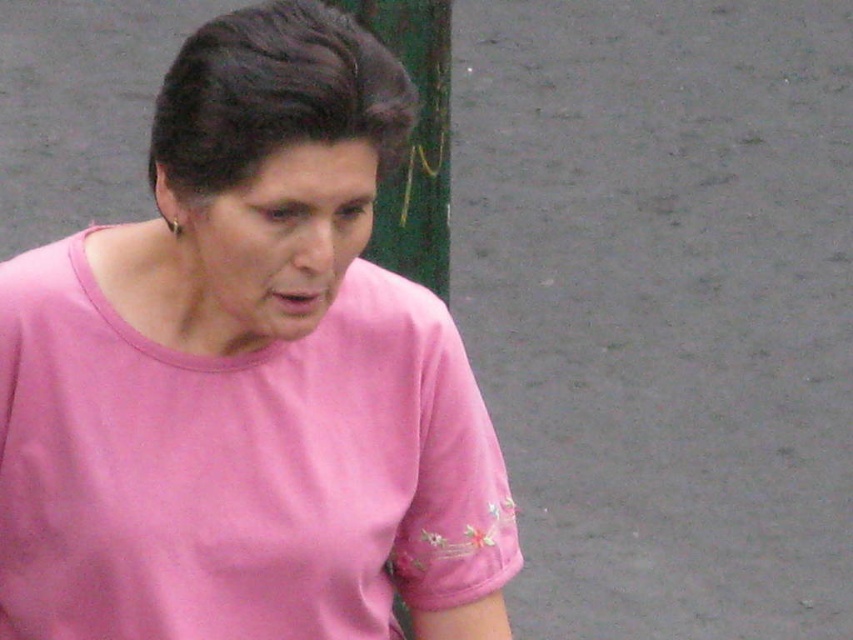
Question: Does pink fabric shirt at center have a larger size compared to green painted wood pole at upper center?

Choices:
 (A) no
 (B) yes

Answer: (B)

Question: Which object is farther from the camera taking this photo?

Choices:
 (A) pink fabric shirt at center
 (B) green painted wood pole at upper center

Answer: (B)

Question: Which of the following is the farthest from the observer?

Choices:
 (A) (68, 348)
 (B) (440, 19)

Answer: (B)

Question: Is pink fabric shirt at center thinner than green painted wood pole at upper center?

Choices:
 (A) yes
 (B) no

Answer: (B)

Question: Does pink fabric shirt at center have a larger size compared to green painted wood pole at upper center?

Choices:
 (A) yes
 (B) no

Answer: (A)